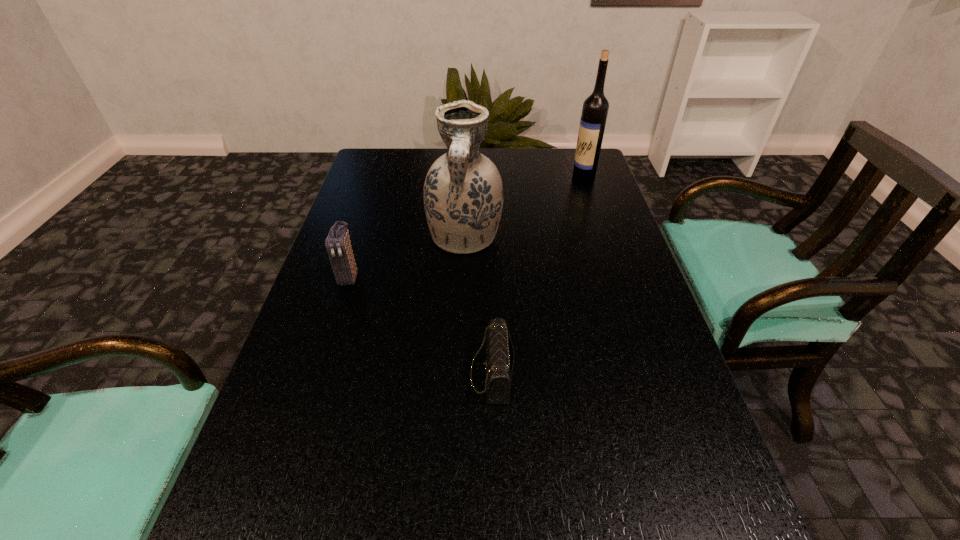
At what (x,y) coordinates should I click in order to perform the action: click on the closest object to the second shortest object. Please return your answer as a coordinate pair (x, y). This screenshot has height=540, width=960. Looking at the image, I should click on (463, 197).